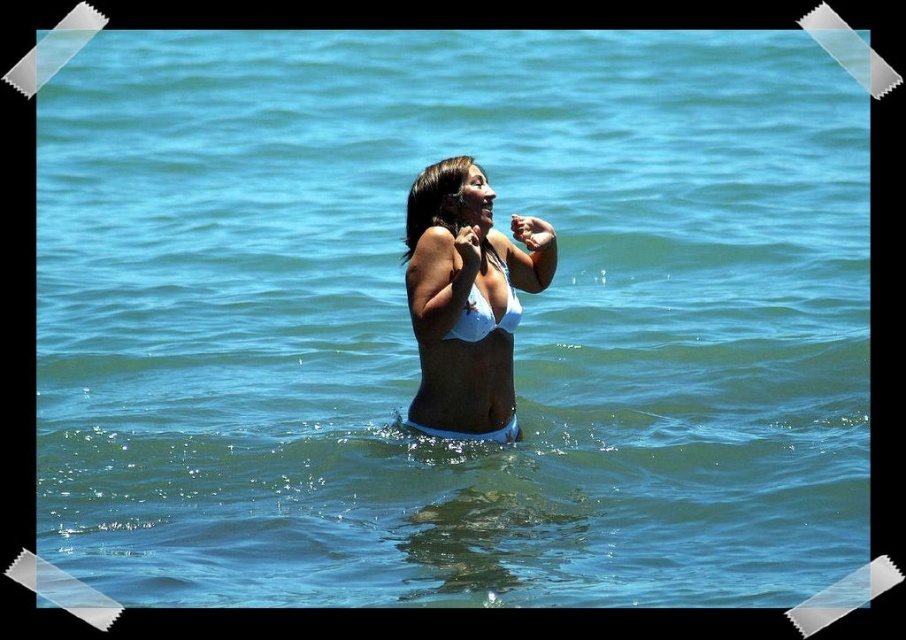
You are a photographer at the beach and want to capture the white matte bikini at center and the white matte bikini top at center in a single shot. Which part of the bikini is positioned higher in the image?

The white matte bikini at center is above the white matte bikini top at center, so the white matte bikini at center is positioned higher in the image.

You are a photographer trying to capture the white matte bikini at center in the image. The coordinates provided are point (467,300). Based on the scene description, where should you focus your camera to ensure the white matte bikini at center is in the center of the frame?

The point (467,300) marks the location of the white matte bikini at center, so you should focus your camera on those coordinates to ensure the white matte bikini at center is centered in the frame.